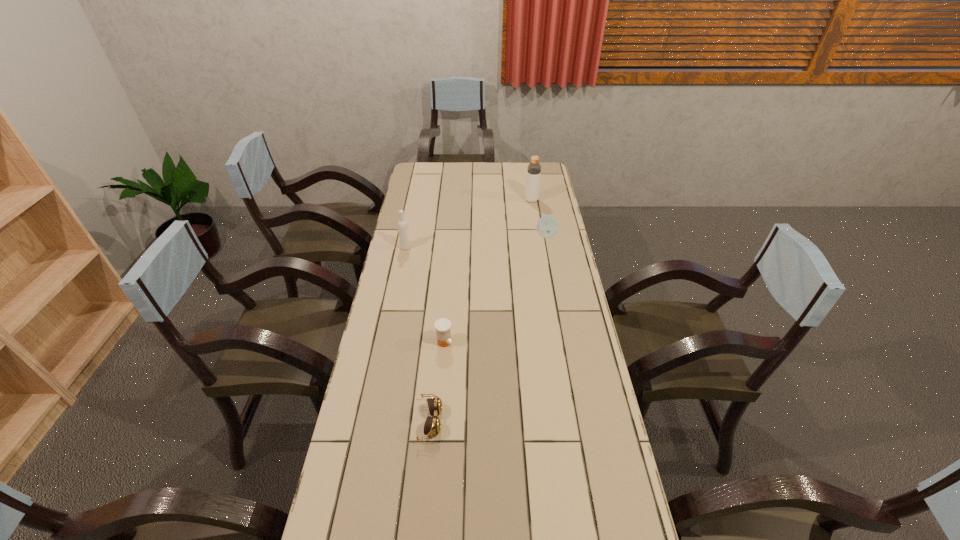
I want to click on free space that satisfies the following two spatial constraints: 1. on the label of the medicine; 2. through the lenses of the nearest object, so click(x=438, y=421).

I want to click on vacant space that satisfies the following two spatial constraints: 1. on the label of the second nearest object; 2. through the lenses of the shortest object, so click(438, 421).

Identify the location of vacant space that satisfies the following two spatial constraints: 1. on the front side of the bottle; 2. through the lenses of the shortest object. This screenshot has height=540, width=960. (567, 421).

At what (x,y) coordinates should I click in order to perform the action: click on free region that satisfies the following two spatial constraints: 1. on the front side of the farthest object; 2. through the lenses of the nearest object. Please return your answer as a coordinate pair (x, y). Image resolution: width=960 pixels, height=540 pixels. Looking at the image, I should click on (567, 421).

You are a GUI agent. You are given a task and a screenshot of the screen. Output one action in this format:
    pyautogui.click(x=<x>, y=<y>)
    Task: Click on the free space that satisfies the following two spatial constraints: 1. on the label of the medicine; 2. through the lenses of the shortest object
    
    Given the screenshot: What is the action you would take?
    pyautogui.click(x=438, y=421)